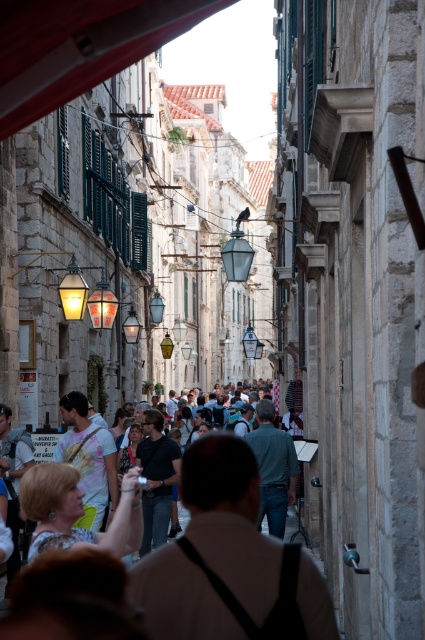
You are a street performer carrying a large prop that is 1.2 meters wide. You need to pass through the gap between the dark gray fabric at center and the light beige fabric purse at center. Can your prop fit through the gap?

The dark gray fabric at center is wider than the light beige fabric purse at center. However, the total width of the gap between them isn

You are standing on the street and see the dark gray fabric at center. Can you estimate its location in terms of coordinates?

The dark gray fabric at center is located at coordinates point [231,520].